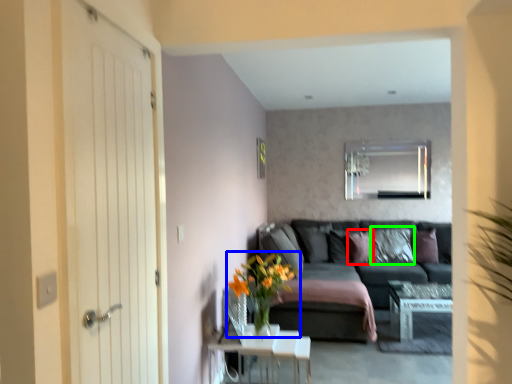
Question: Which is nearer to the pillow (highlighted by a red box)? floral arrangement (highlighted by a blue box) or pillow (highlighted by a green box).

Choices:
 (A) floral arrangement
 (B) pillow

Answer: (B)